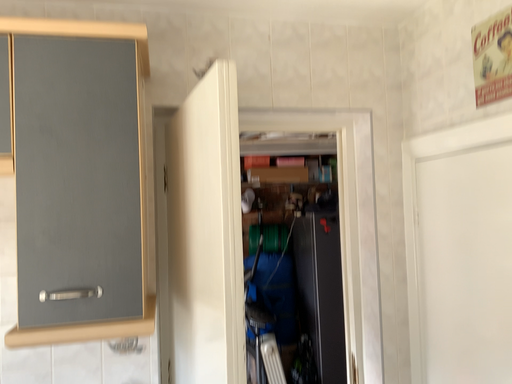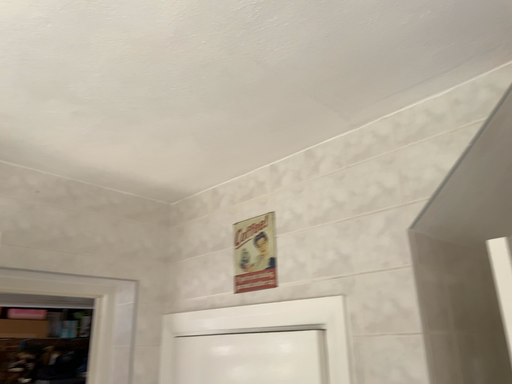
Question: Which way did the camera rotate in the video?

Choices:
 (A) rotated upward
 (B) rotated downward

Answer: (A)